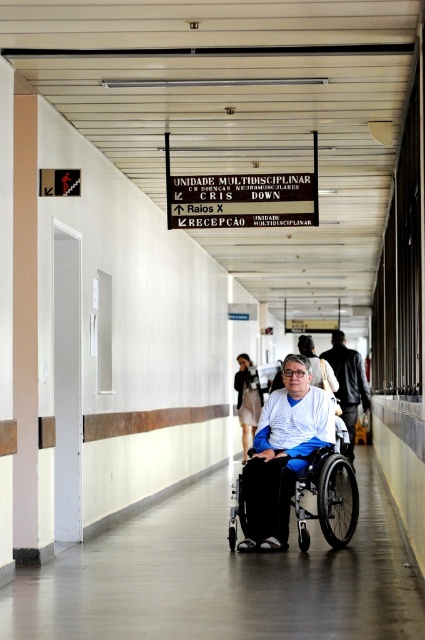
Question: Is black plastic sign at upper center to the right of light beige fabric dress at center from the viewer's perspective?

Choices:
 (A) no
 (B) yes

Answer: (A)

Question: Can you confirm if black plastic sign at upper center is bigger than blue fabric wheelchair at center?

Choices:
 (A) no
 (B) yes

Answer: (A)

Question: Which point is farther to the camera?

Choices:
 (A) black plastic sign at upper center
 (B) silver metallic wheelchair at center
 (C) blue fabric wheelchair at center

Answer: (C)

Question: Which object is the farthest from the light beige fabric dress at center?

Choices:
 (A) silver metallic wheelchair at center
 (B) blue fabric wheelchair at center
 (C) black plastic sign at upper center

Answer: (A)

Question: Based on their relative distances, which object is farther from the light beige fabric dress at center?

Choices:
 (A) black plastic sign at upper center
 (B) blue fabric wheelchair at center

Answer: (A)

Question: Does blue fabric wheelchair at center appear on the left side of light beige fabric dress at center?

Choices:
 (A) yes
 (B) no

Answer: (B)